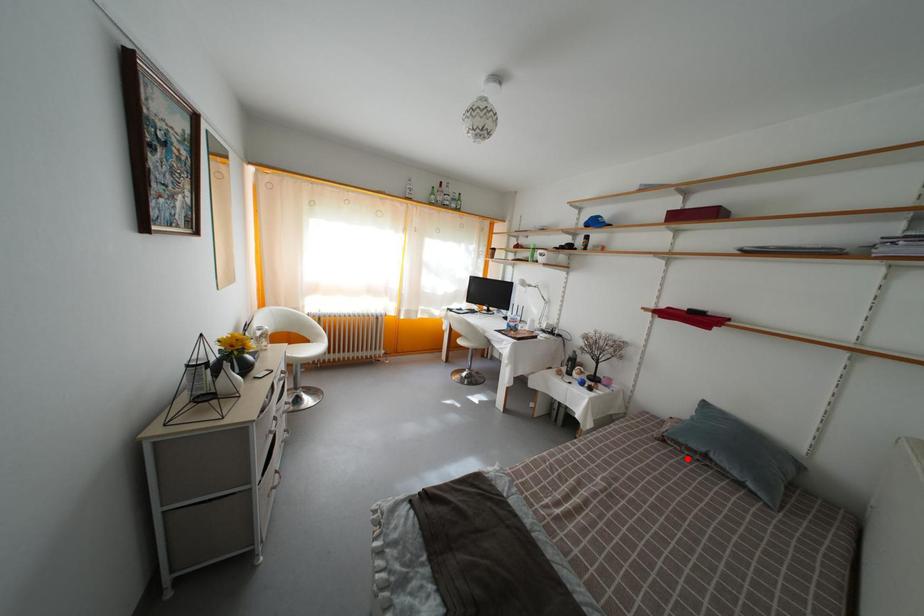
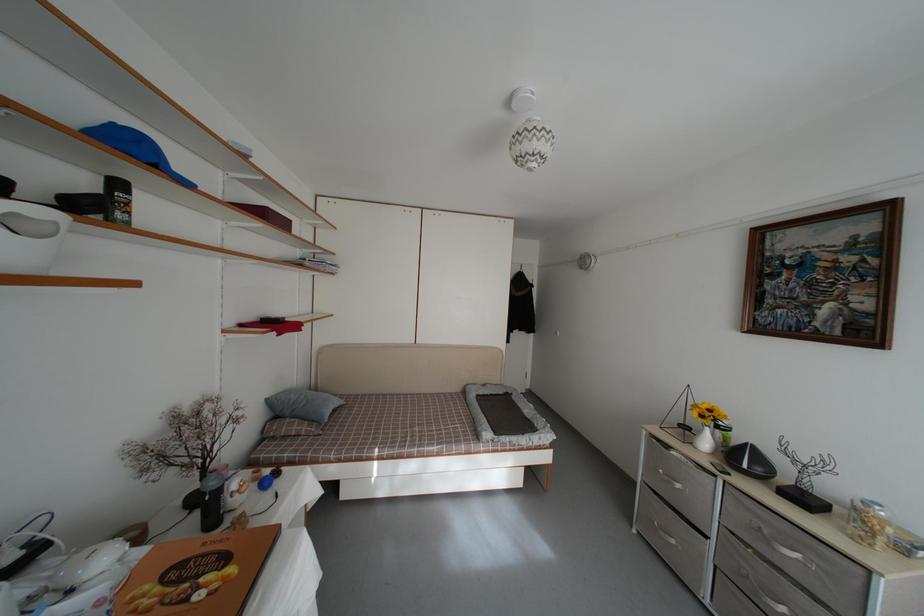
Where in the second image is the point corresponding to the highlighted location from the first image?

(332, 431)